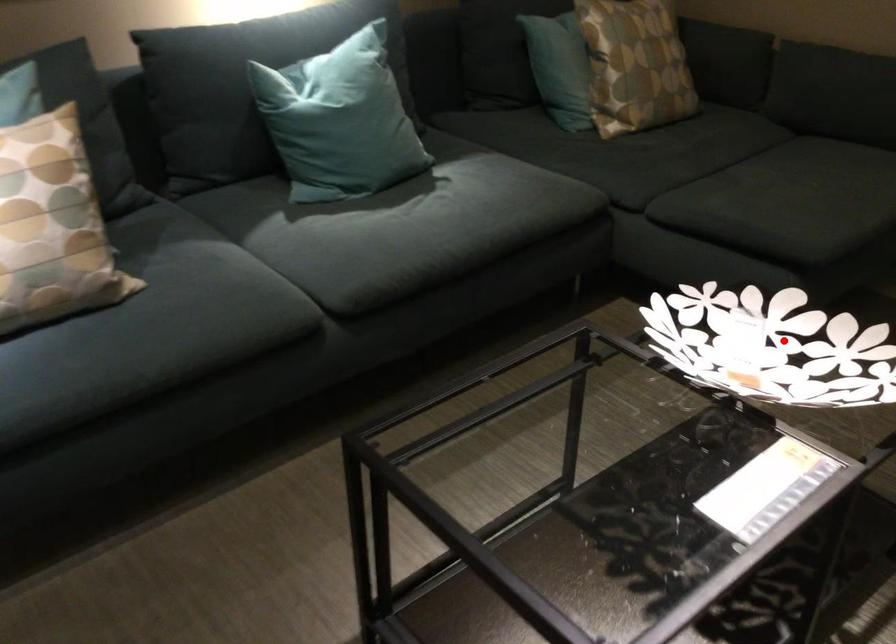
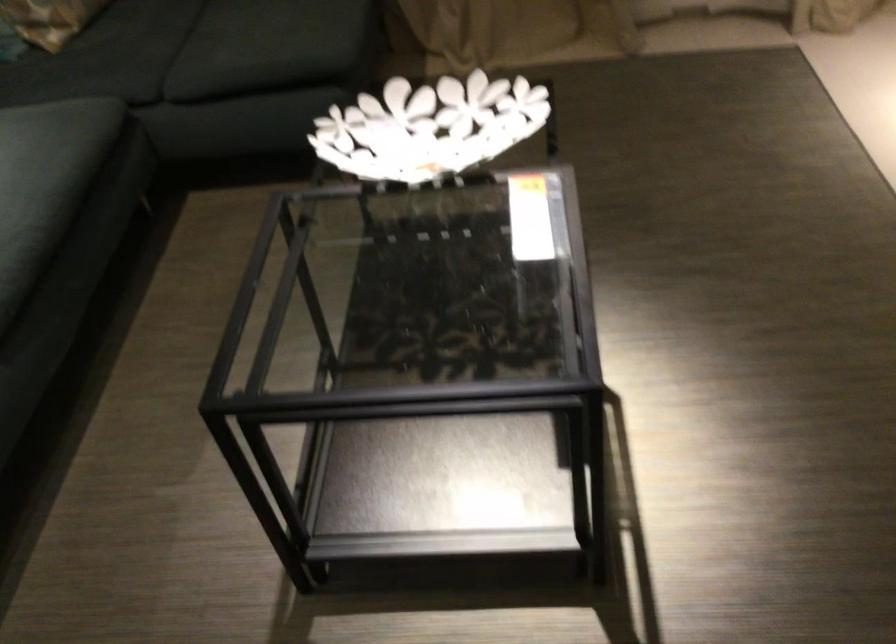
Where in the second image is the point corresponding to the highlighted location from the first image?

(429, 127)